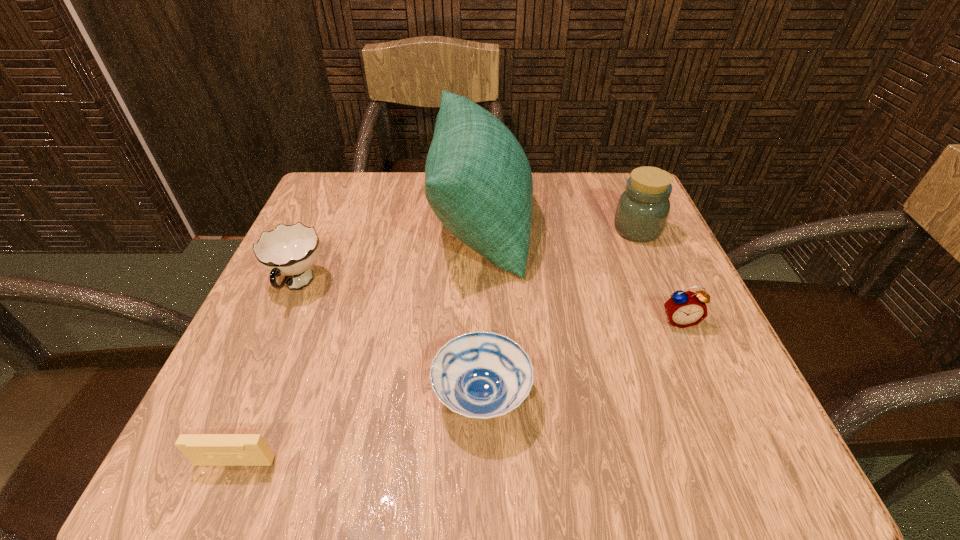
Where is `free space that satisfies the following two spatial constraints: 1. on the back side of the second nearest object; 2. on the front-facing side of the tallest object`? free space that satisfies the following two spatial constraints: 1. on the back side of the second nearest object; 2. on the front-facing side of the tallest object is located at coordinates (481, 221).

Identify the location of free space that satisfies the following two spatial constraints: 1. on the side of the cup with the handle; 2. on the left side of the fifth farthest object. This screenshot has height=540, width=960. (249, 397).

At what (x,y) coordinates should I click in order to perform the action: click on vacant area in the image that satisfies the following two spatial constraints: 1. on the side of the second nearest object with the handle; 2. on the right side of the cup. Please return your answer as a coordinate pair (x, y). This screenshot has height=540, width=960. Looking at the image, I should click on (249, 397).

Find the location of a particular element. vacant space that satisfies the following two spatial constraints: 1. on the front-facing side of the fifth shortest object; 2. on the right side of the cushion is located at coordinates (480, 230).

You are a GUI agent. You are given a task and a screenshot of the screen. Output one action in this format:
    pyautogui.click(x=<x>, y=<y>)
    Task: Click on the vacant area in the image that satisfies the following two spatial constraints: 1. on the front-facing side of the tallest object; 2. at the front of the videotape with spools
    The image size is (960, 540).
    Given the screenshot: What is the action you would take?
    pyautogui.click(x=480, y=462)

Find the location of a particular element. The height and width of the screenshot is (540, 960). free space that satisfies the following two spatial constraints: 1. on the front-facing side of the second tallest object; 2. on the left side of the cushion is located at coordinates (480, 230).